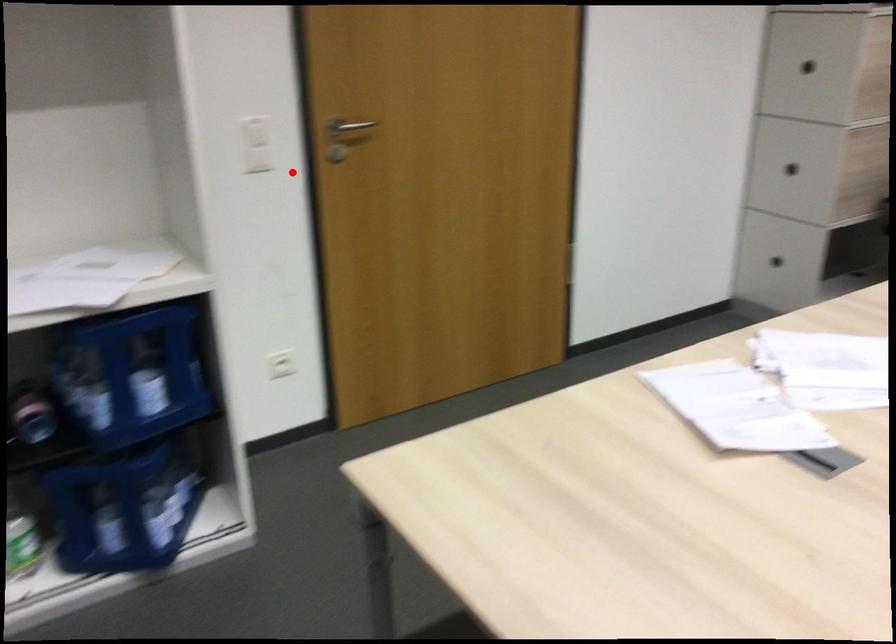
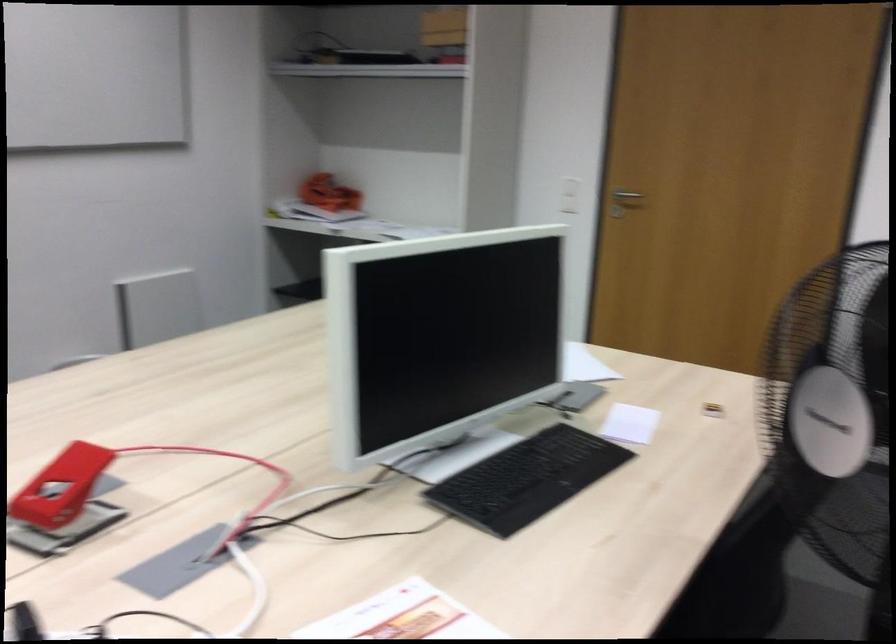
In the second image, find the point that corresponds to the highlighted location in the first image.

(624, 202)